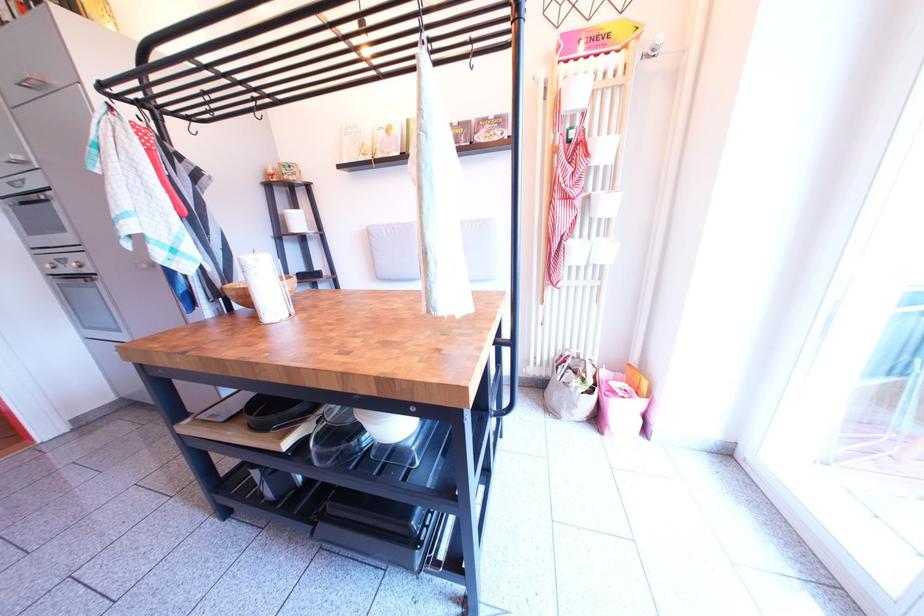
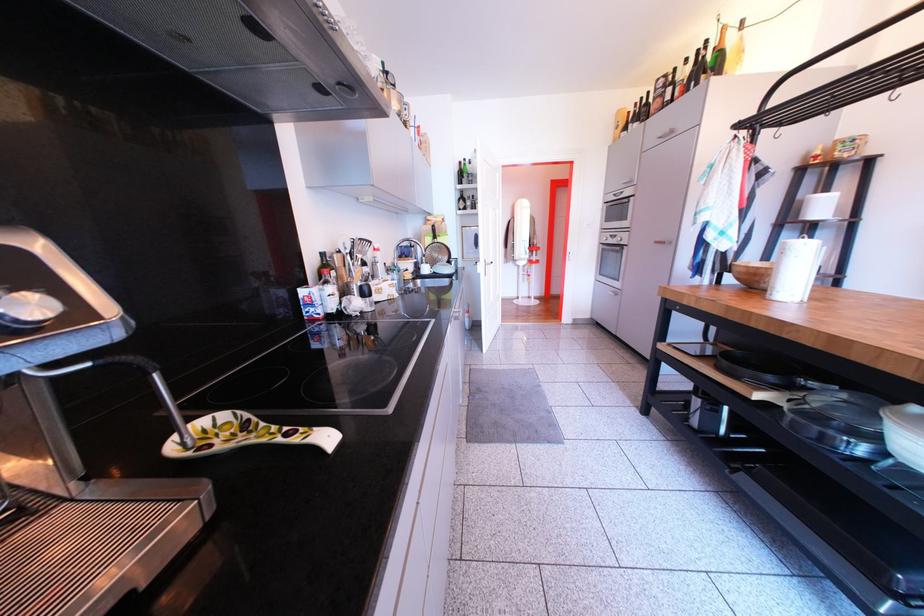
Question: I am providing you with two images of the same scene from different viewpoints. Which of the following objects are not visible in image2?

Choices:
 (A) black rack hook
 (B) oven door handle
 (C) green glass bottle
 (D) none of these

Answer: (D)